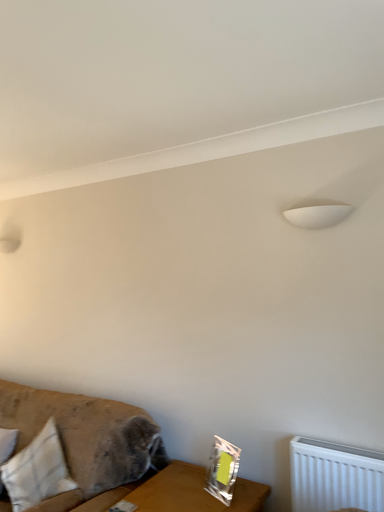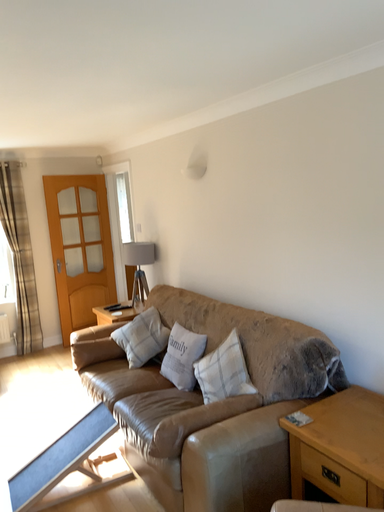
Question: Which way did the camera rotate in the video?

Choices:
 (A) rotated upward
 (B) rotated downward

Answer: (B)